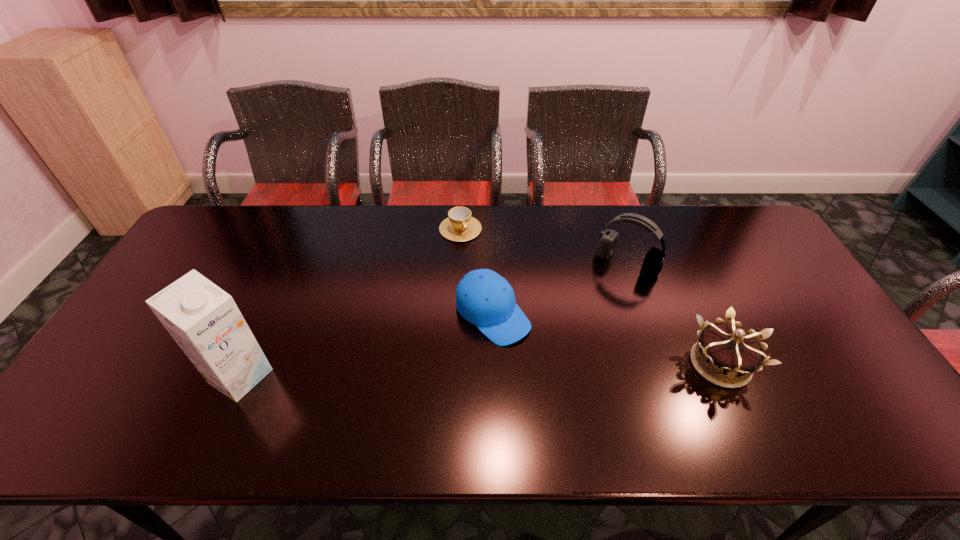
The image size is (960, 540). In order to click on vacant area located 0.180m with the handle on the side of the shortest object in this screenshot , I will do `click(488, 278)`.

What are the coordinates of `vacant area situated with the handle on the side of the shortest object` in the screenshot? It's located at (514, 323).

Locate an element on the screen. free space located with the handle on the side of the shortest object is located at coordinates (512, 321).

This screenshot has height=540, width=960. Find the location of `vacant space situated on the headband of the second tallest object`. vacant space situated on the headband of the second tallest object is located at coordinates (568, 338).

I want to click on vacant region located on the headband of the second tallest object, so click(595, 302).

You are a GUI agent. You are given a task and a screenshot of the screen. Output one action in this format:
    pyautogui.click(x=<x>, y=<y>)
    Task: Click on the free space located 0.390m on the headband of the second tallest object
    This screenshot has height=540, width=960.
    Given the screenshot: What is the action you would take?
    pyautogui.click(x=547, y=366)

What are the coordinates of `blank space located on the front-facing side of the fourth tallest object` in the screenshot? It's located at (589, 406).

The image size is (960, 540). Identify the location of vacant space located on the front-facing side of the fourth tallest object. (553, 372).

In order to click on free location located on the front-facing side of the fourth tallest object in this screenshot , I will do `click(534, 354)`.

Where is `cup positioned at the far edge`? cup positioned at the far edge is located at coordinates (459, 226).